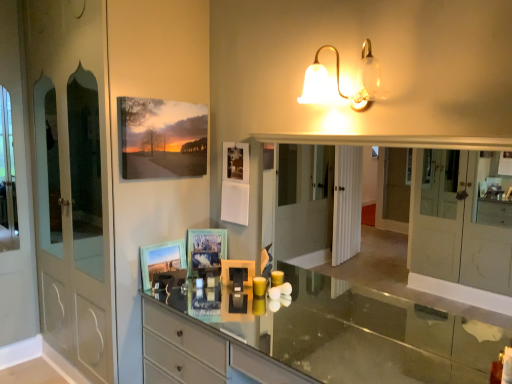
The image size is (512, 384). In order to click on vacant space situated above clear glass mirror at center (from a real-world perspective) in this screenshot , I will do `click(367, 136)`.